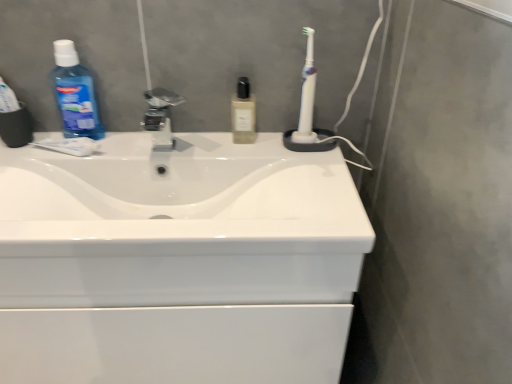
Image resolution: width=512 pixels, height=384 pixels. What are the coordinates of `vacant region to the left of satin nickel faucet at center` in the screenshot? It's located at (110, 140).